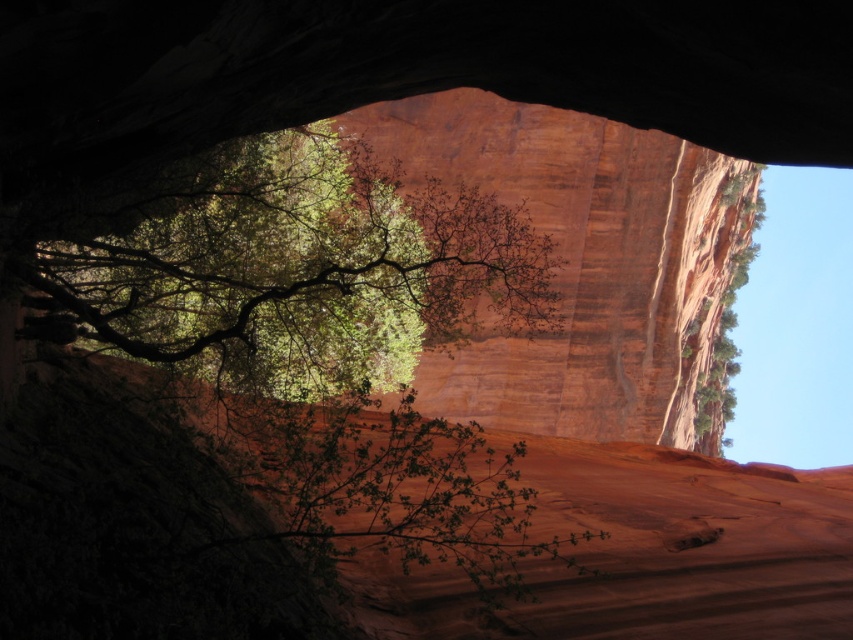
You are standing at the entrance of the natural archway and want to take a photo of the green leafy tree at center. Where should you position yourself to ensure the tree is centered in your photo?

To center the green leafy tree at center in your photo, position yourself directly in line with its 2D coordinates at point 0.419 on the horizontal axis and 0.335 on the vertical axis.